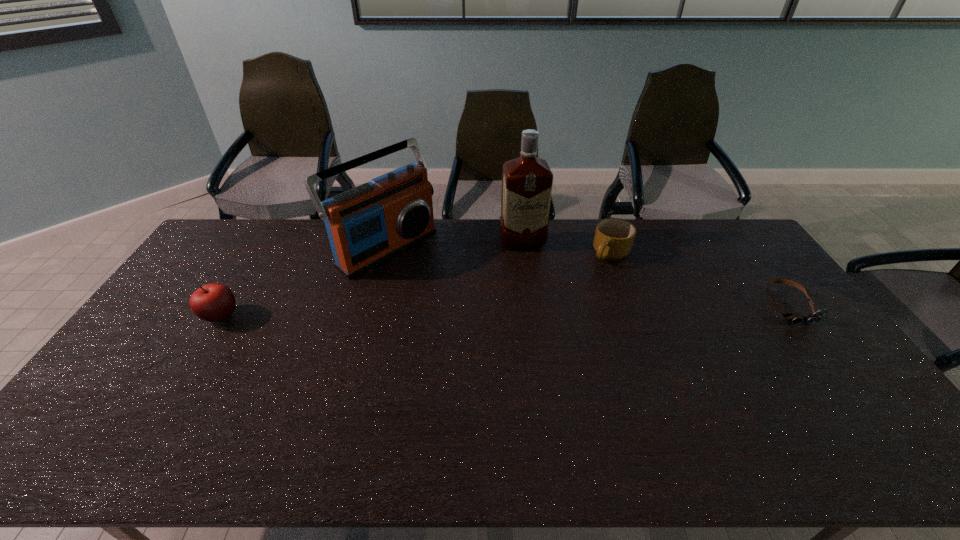
Locate an element on the screen. free spot on the desktop that is between the apple and the rightmost object and is positioned on the front-facing side of the radio receiver is located at coordinates (473, 312).

You are a GUI agent. You are given a task and a screenshot of the screen. Output one action in this format:
    pyautogui.click(x=<x>, y=<y>)
    Task: Click on the free spot on the desktop that is between the apple and the rightmost object and is positioned on the side with the handle of the fourth object from left to right
    
    Given the screenshot: What is the action you would take?
    (528, 310)

Locate an element on the screen. The image size is (960, 540). vacant space on the desktop that is between the apple and the shortest object and is positioned on the front label of the liquor is located at coordinates (543, 310).